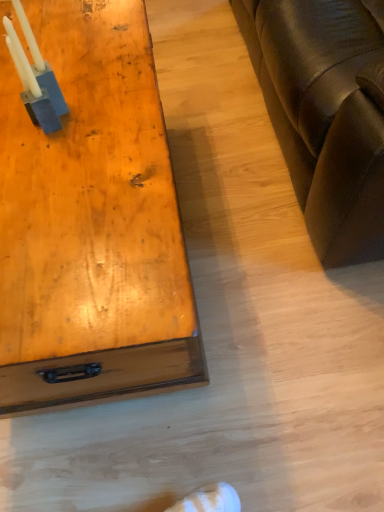
Question: Considering the relative sizes of brown leather couch at right and wooden table at left in the image provided, is brown leather couch at right bigger than wooden table at left?

Choices:
 (A) no
 (B) yes

Answer: (B)

Question: Is brown leather couch at right to the right of wooden table at left from the viewer's perspective?

Choices:
 (A) yes
 (B) no

Answer: (A)

Question: From a real-world perspective, is brown leather couch at right located higher than wooden table at left?

Choices:
 (A) yes
 (B) no

Answer: (A)

Question: Can you confirm if brown leather couch at right is smaller than wooden table at left?

Choices:
 (A) yes
 (B) no

Answer: (B)

Question: Would you say brown leather couch at right is outside wooden table at left?

Choices:
 (A) yes
 (B) no

Answer: (A)

Question: Is brown leather couch at right shorter than wooden table at left?

Choices:
 (A) no
 (B) yes

Answer: (A)

Question: Is wooden table at left not inside brown leather couch at right?

Choices:
 (A) yes
 (B) no

Answer: (A)

Question: Is wooden table at left wider than brown leather couch at right?

Choices:
 (A) no
 (B) yes

Answer: (A)

Question: Can you confirm if wooden table at left is bigger than brown leather couch at right?

Choices:
 (A) yes
 (B) no

Answer: (B)

Question: Could you tell me if wooden table at left is turned towards brown leather couch at right?

Choices:
 (A) no
 (B) yes

Answer: (A)

Question: Considering the relative positions of wooden table at left and brown leather couch at right in the image provided, is wooden table at left to the right of brown leather couch at right from the viewer's perspective?

Choices:
 (A) no
 (B) yes

Answer: (A)

Question: Considering the relative positions of wooden table at left and brown leather couch at right in the image provided, is wooden table at left in front of brown leather couch at right?

Choices:
 (A) yes
 (B) no

Answer: (B)

Question: Is point (321, 22) closer or farther from the camera than point (3, 115)?

Choices:
 (A) farther
 (B) closer

Answer: (A)